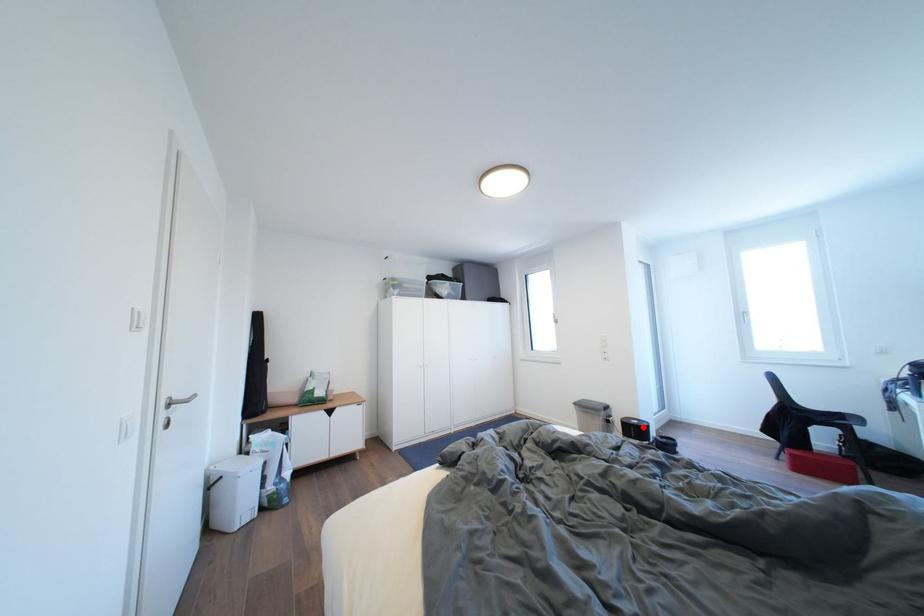
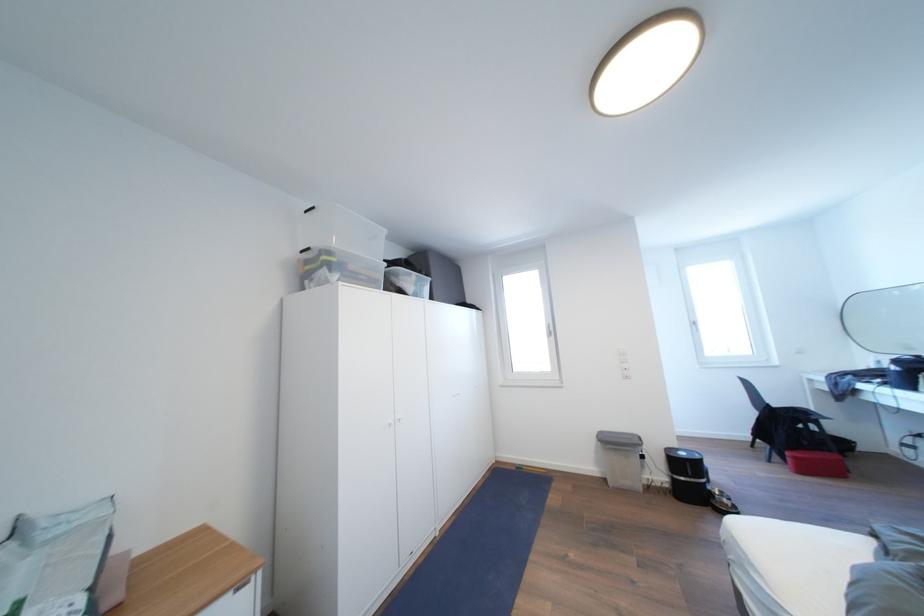
Where in the second image is the point corresponding to the highlighted location from the first image?

(689, 459)